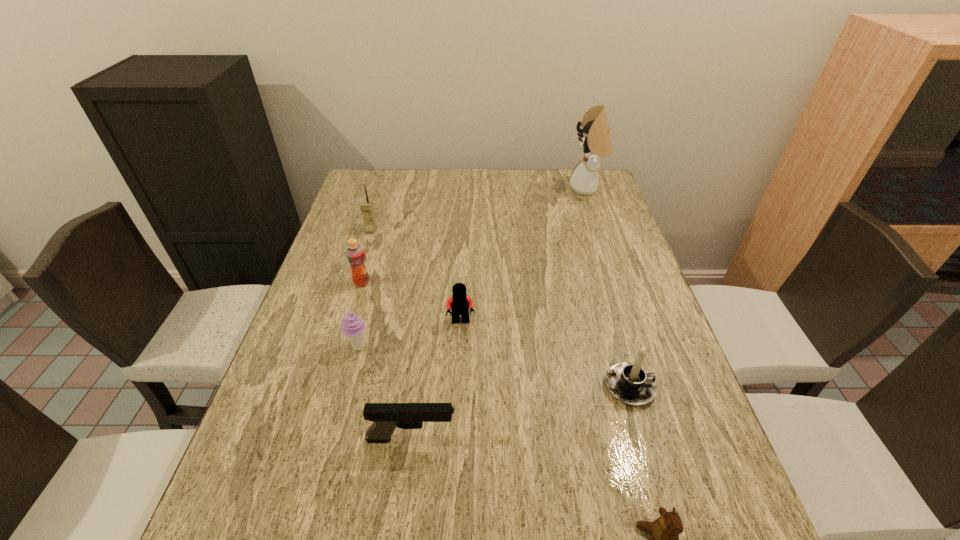
Where is `the farthest object`? Image resolution: width=960 pixels, height=540 pixels. the farthest object is located at coordinates (595, 140).

Find the location of a particular element. This screenshot has width=960, height=540. the tallest object is located at coordinates (595, 140).

The width and height of the screenshot is (960, 540). Find the location of `cellular telephone`. cellular telephone is located at coordinates (366, 207).

This screenshot has height=540, width=960. Find the location of `orange juice`. orange juice is located at coordinates (355, 255).

Where is `candle holder`? The height and width of the screenshot is (540, 960). candle holder is located at coordinates (630, 383).

Identify the location of the fourth farthest object. The height and width of the screenshot is (540, 960). (459, 303).

Find the location of a particular element. icecream is located at coordinates (353, 327).

I want to click on the second nearest object, so click(x=386, y=417).

Where is `vacant space located 0.190m at the front face of the tallest object`? The image size is (960, 540). vacant space located 0.190m at the front face of the tallest object is located at coordinates (516, 188).

Where is `vacant space located at the front face of the tallest object`? The height and width of the screenshot is (540, 960). vacant space located at the front face of the tallest object is located at coordinates (539, 188).